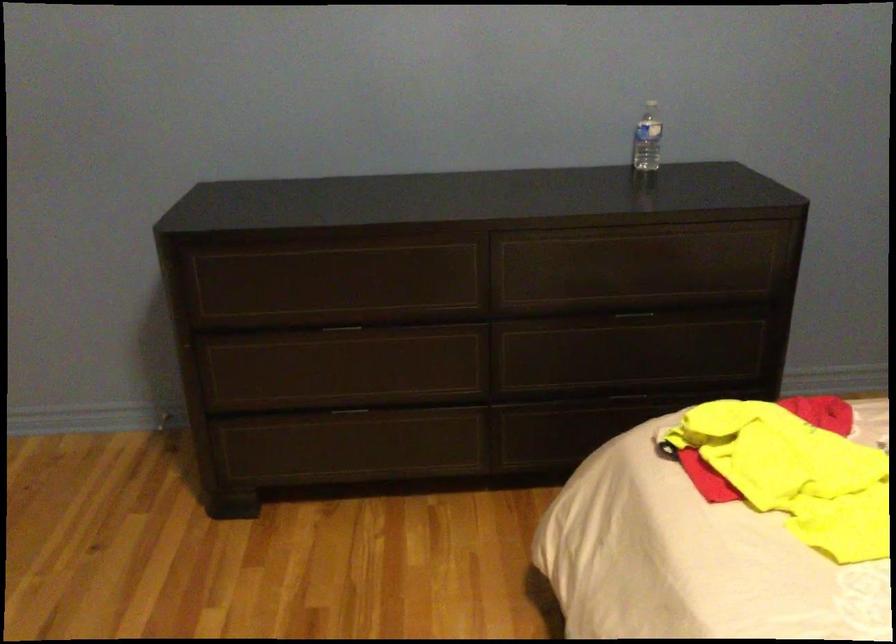
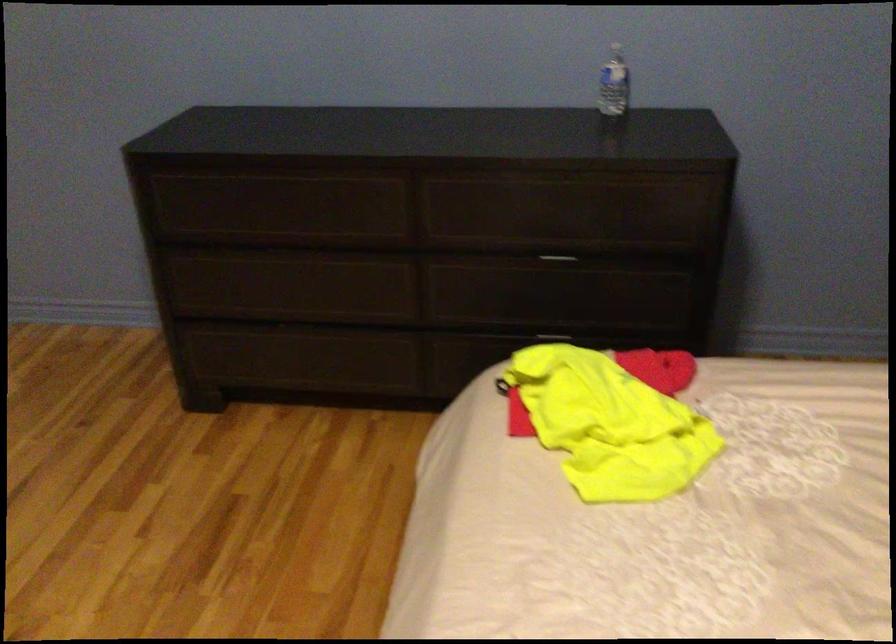
The point at (652,136) is marked in the first image. Where is the corresponding point in the second image?

(614, 84)